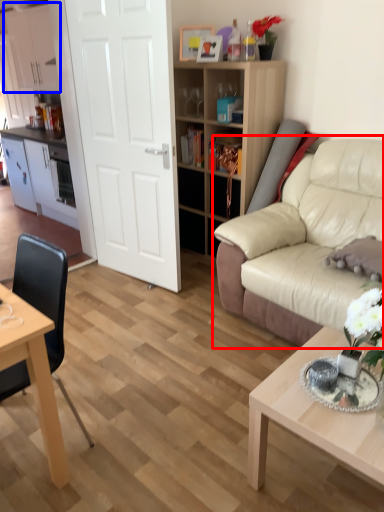
Question: Which object appears farthest to the camera in this image, studio couch (highlighted by a red box) or cabinetry (highlighted by a blue box)?

Choices:
 (A) studio couch
 (B) cabinetry

Answer: (B)